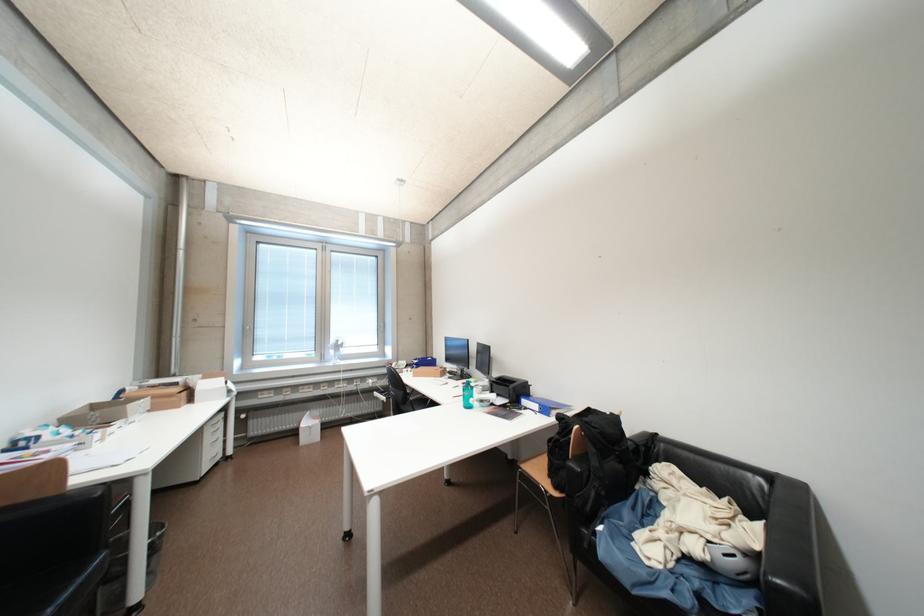
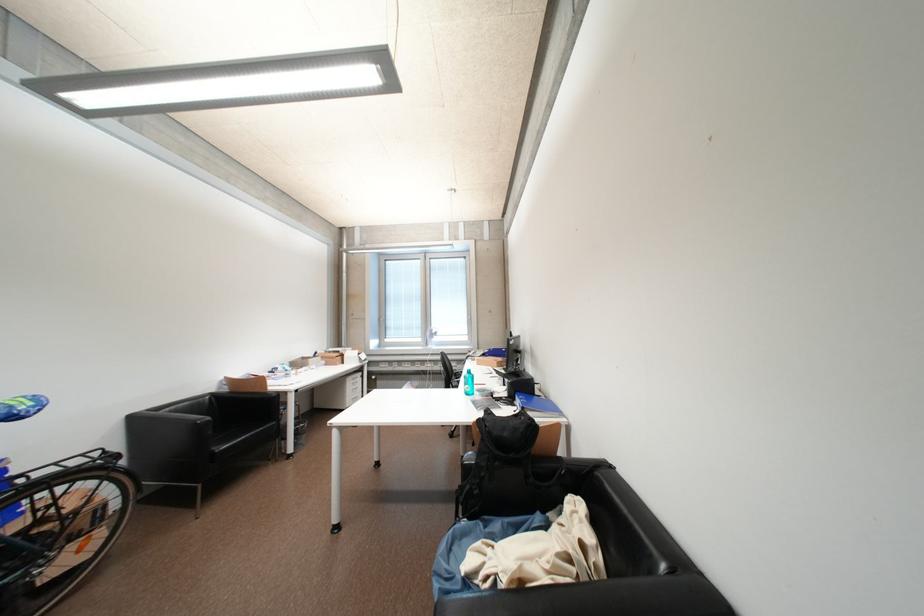
The point at (x=34, y=499) is marked in the first image. Where is the corresponding point in the second image?

(264, 392)